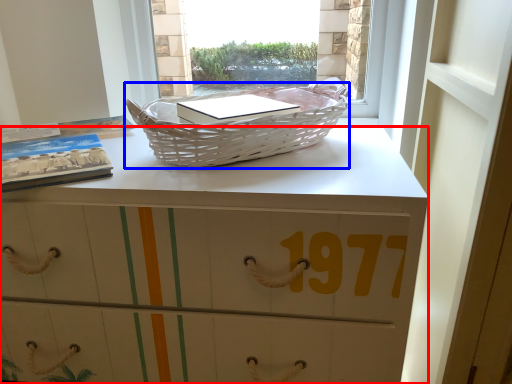
Question: Which point is further to the camera, desk (highlighted by a red box) or picnic basket (highlighted by a blue box)?

Choices:
 (A) desk
 (B) picnic basket

Answer: (B)